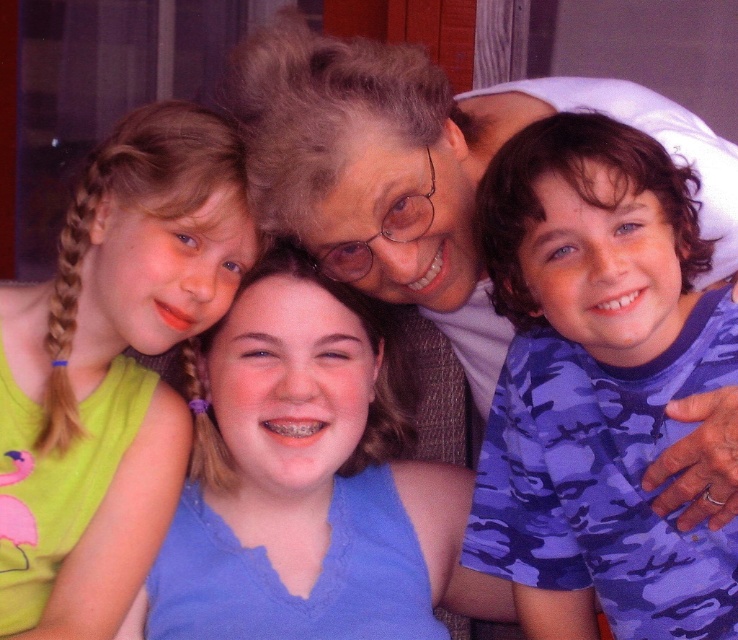
Question: Does matte black glasses at center have a greater width compared to green fabric shirt at left?

Choices:
 (A) no
 (B) yes

Answer: (B)

Question: Does camouflage shirt at right have a lesser width compared to green fabric shirt at left?

Choices:
 (A) yes
 (B) no

Answer: (A)

Question: Which object is farther from the camera taking this photo?

Choices:
 (A) green fabric shirt at left
 (B) camouflage shirt at right

Answer: (A)

Question: Where is camouflage shirt at right located in relation to matte black glasses at center in the image?

Choices:
 (A) right
 (B) left

Answer: (A)

Question: Which point is closer to the camera?

Choices:
 (A) camouflage shirt at right
 (B) green fabric shirt at left
 (C) matte black glasses at center

Answer: (A)

Question: Which of the following is the closest to the observer?

Choices:
 (A) camouflage shirt at right
 (B) green fabric shirt at left

Answer: (A)